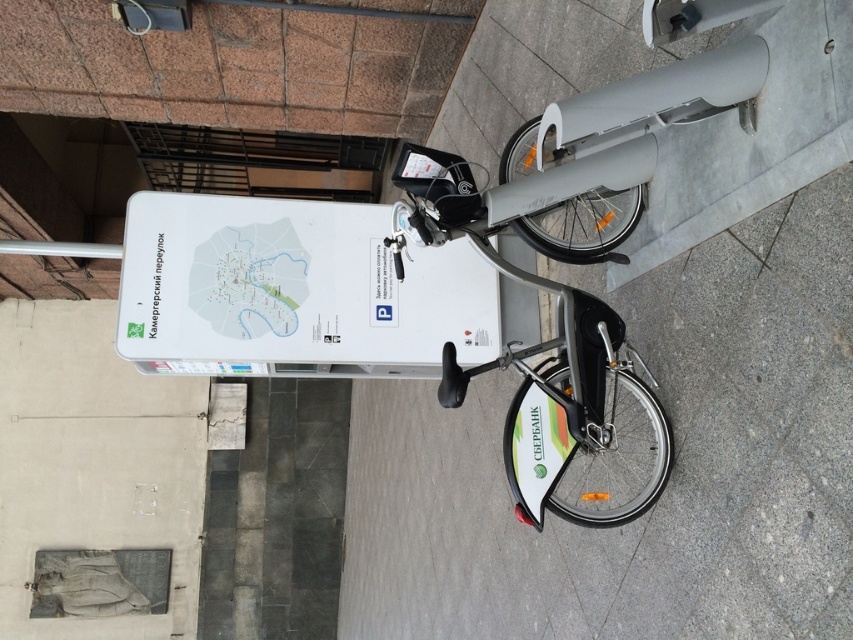
Does white matte sign at upper center have a larger size compared to metallic silver bicycle at center?

Actually, white matte sign at upper center might be smaller than metallic silver bicycle at center.

Which is behind, point (126, 355) or point (554, 444)?

Positioned behind is point (126, 355).

Is point (212, 260) less distant than point (456, 198)?

No, it is not.

You are a GUI agent. You are given a task and a screenshot of the screen. Output one action in this format:
    pyautogui.click(x=<x>, y=<y>)
    Task: Click on the white matte sign at upper center
    
    Given the screenshot: What is the action you would take?
    pyautogui.click(x=293, y=291)